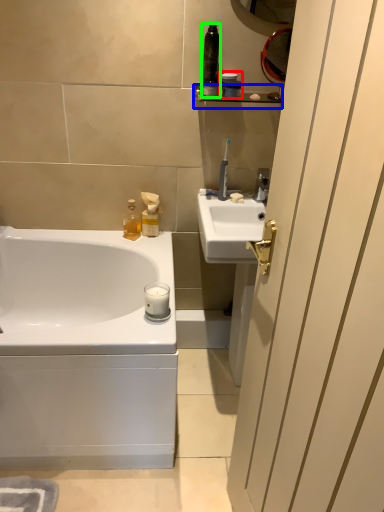
Question: Estimate the real-world distances between objects in this image. Which object is farther from toiletry (highlighted by a red box), balustrade (highlighted by a blue box) or toiletry (highlighted by a green box)?

Choices:
 (A) balustrade
 (B) toiletry

Answer: (B)